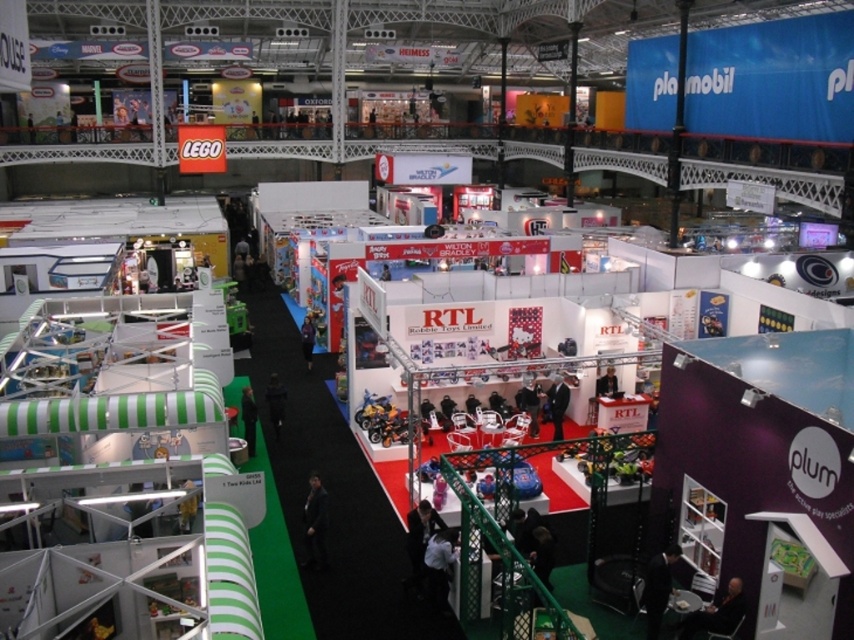
You are a photographer at the exhibition and need to capture both the dark gray suit at lower right and the black fabric jacket at center in a single frame. Which clothing item should you position closer to the camera to ensure both are fully visible without cropping?

To ensure both the dark gray suit at lower right and the black fabric jacket at center are fully visible, position the dark gray suit at lower right closer to the camera since it has a lesser height compared to the black fabric jacket at center.

You are an attendee at the trade show and want to reach the booth of Robbie Toys Limited. You are currently standing near the dark gray suit at lower right and the black leather jacket at center. Which object should you move towards to get closer to the Robbie Toys Limited booth?

The dark gray suit at lower right is closer to the viewer than the black leather jacket at center, so moving towards the dark gray suit at lower right would bring you closer to the Robbie Toys Limited booth.